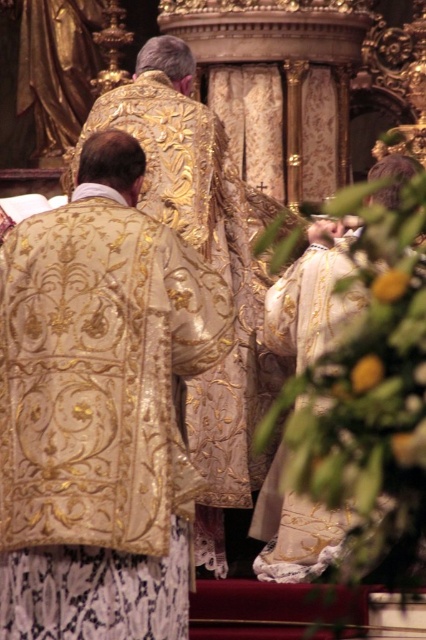
Question: Observing the image, what is the correct spatial positioning of gold embroidered robe at center in reference to white embroidered robe at center?

Choices:
 (A) right
 (B) left

Answer: (B)

Question: Which of the following is the closest to the observer?

Choices:
 (A) (40, 429)
 (B) (301, 556)

Answer: (A)

Question: Which point is closer to the camera taking this photo?

Choices:
 (A) (109, 413)
 (B) (331, 321)

Answer: (A)

Question: In this image, where is gold embroidered robe at center located relative to white embroidered robe at center?

Choices:
 (A) right
 (B) left

Answer: (B)

Question: Is gold embroidered robe at center wider than white embroidered robe at center?

Choices:
 (A) yes
 (B) no

Answer: (A)

Question: Which point is farther to the camera?

Choices:
 (A) white embroidered robe at center
 (B) gold embroidered robe at center

Answer: (A)